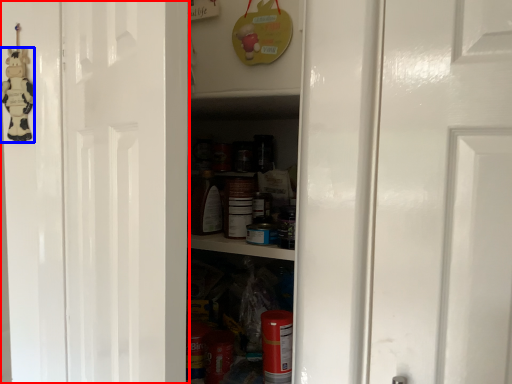
Question: Which point is further to the camera, door (highlighted by a red box) or toy (highlighted by a blue box)?

Choices:
 (A) door
 (B) toy

Answer: (B)